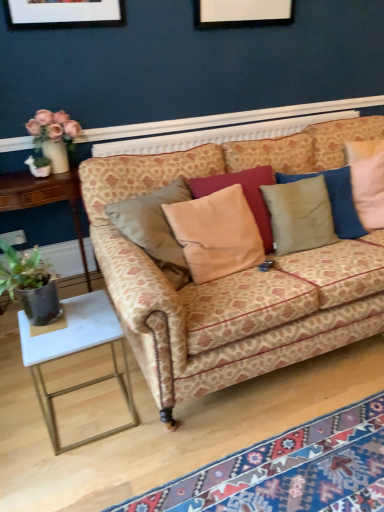
The height and width of the screenshot is (512, 384). What are the coordinates of `vacant region below white marble side table at lower left, the 2th table from the top (from a real-world perspective)` in the screenshot? It's located at (86, 412).